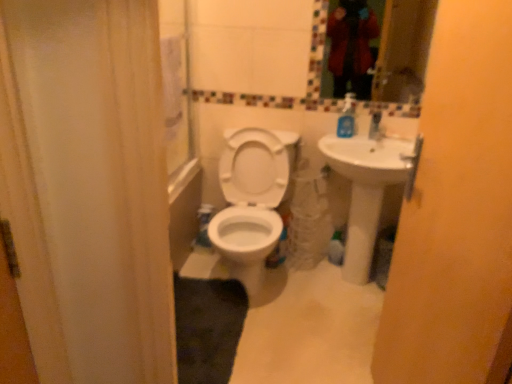
I want to click on free point below white glossy sink at right (from a real-world perspective), so click(344, 284).